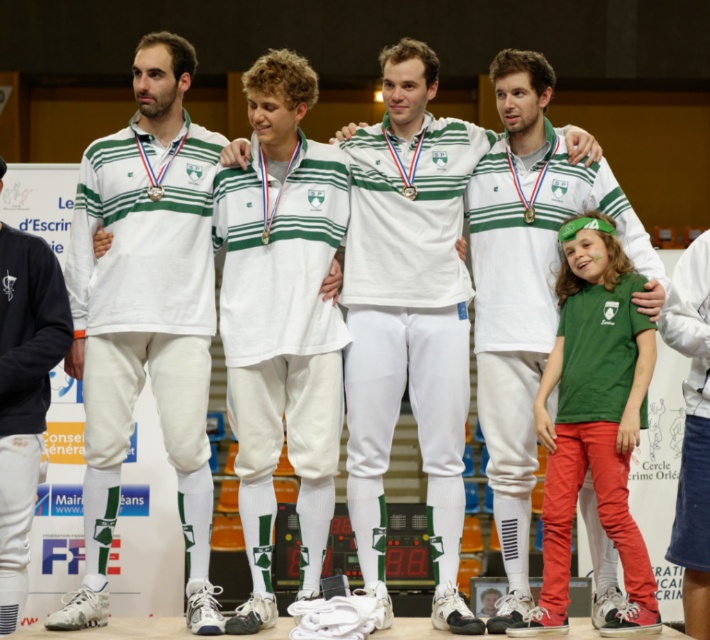
You are designing a mascot costume for a fencing team. The costume requires both pants and a shirt. The pants must be made from a fabric that is as voluminous as the shirt. Given the white fabric pants at left and white cotton shirt at center from the image, which pants should you choose and why?

Result: The white cotton shirt at center occupies more space than the white fabric pants at left. Therefore, you should choose the white fabric pants at left to match the shirt in terms of volume since they are less voluminous.

You are a photographer trying to adjust the lighting for a group photo. You notice the white fabric pants at left and the white cotton shirt at center. Which object is shorter in height?

The white fabric pants at left has a lesser height compared to the white cotton shirt at center, so the white fabric pants at left is shorter in height.

You are a photographer standing in front of the podium. You need to take a photo of the white smooth uniform at center and the white fabric pants at left. Which one will appear larger in the photo?

The white smooth uniform at center will appear larger in the photo because it is closer to the viewer than the white fabric pants at left.